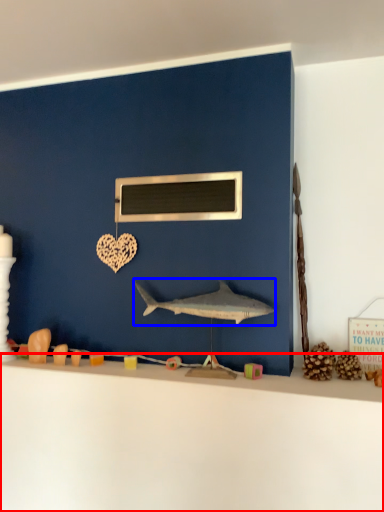
Question: Which point is further to the camera, counter top (highlighted by a red box) or shark (highlighted by a blue box)?

Choices:
 (A) counter top
 (B) shark

Answer: (B)